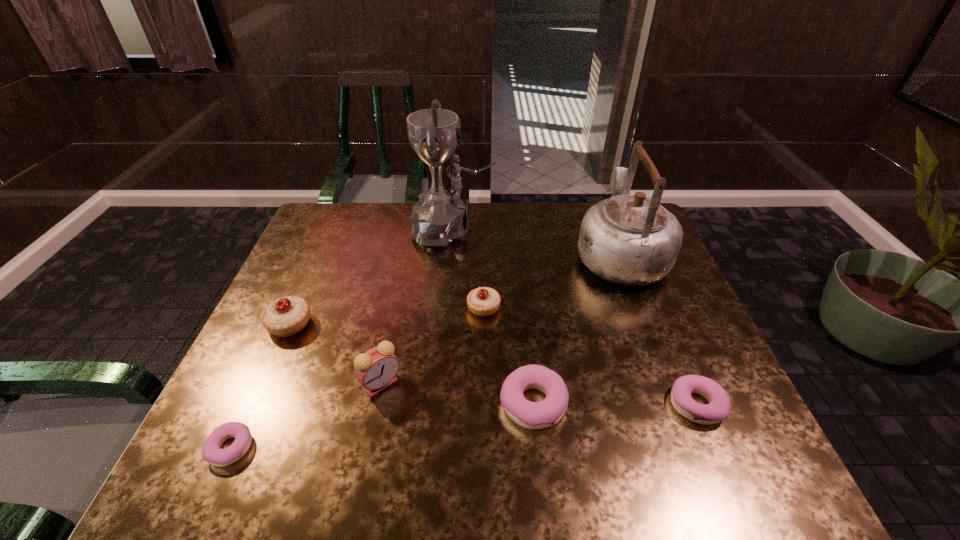
Where is `vacant space that satisfies the following two spatial constraints: 1. on the side with emblem of the tallest object; 2. on the front side of the tallest pastry`? The width and height of the screenshot is (960, 540). vacant space that satisfies the following two spatial constraints: 1. on the side with emblem of the tallest object; 2. on the front side of the tallest pastry is located at coordinates (444, 324).

I want to click on blank area in the image that satisfies the following two spatial constraints: 1. on the side with emblem of the award; 2. on the left side of the third shortest pastry, so click(x=438, y=403).

The width and height of the screenshot is (960, 540). In order to click on free space in the image that satisfies the following two spatial constraints: 1. on the side with emblem of the award; 2. on the left side of the second shortest pastry in this screenshot , I will do `click(438, 404)`.

What are the coordinates of `free space in the image that satisfies the following two spatial constraints: 1. on the side with emblem of the tallest object; 2. on the back side of the fifth tallest object` in the screenshot? It's located at (445, 308).

Locate an element on the screen. The height and width of the screenshot is (540, 960). free space that satisfies the following two spatial constraints: 1. on the side with emblem of the tallest object; 2. at the spout of the seventh shortest object is located at coordinates (450, 254).

I want to click on blank space that satisfies the following two spatial constraints: 1. on the side with emblem of the fourth shortest object; 2. on the left side of the tallest object, so click(x=445, y=308).

What are the coordinates of `blank area in the image that satisfies the following two spatial constraints: 1. on the front side of the bigger beige pastry; 2. on the right side of the rightmost pink pastry` in the screenshot? It's located at (253, 404).